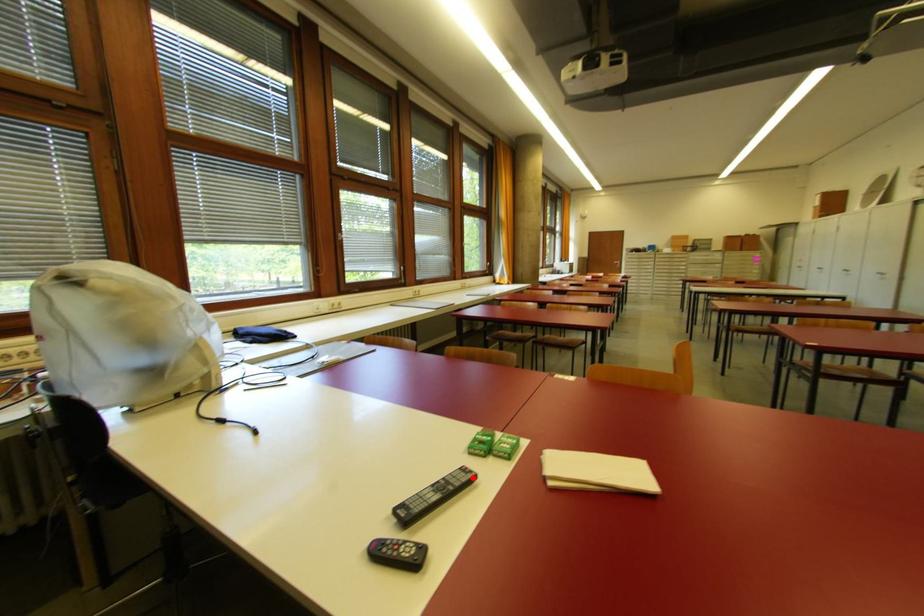
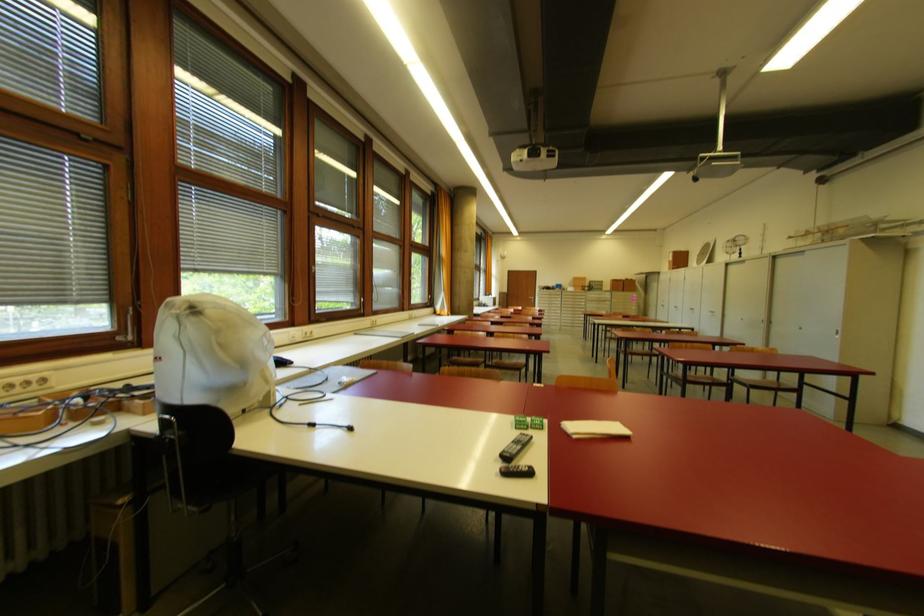
Where in the second image is the point corresponding to the highlighted location from the first image?

(531, 439)